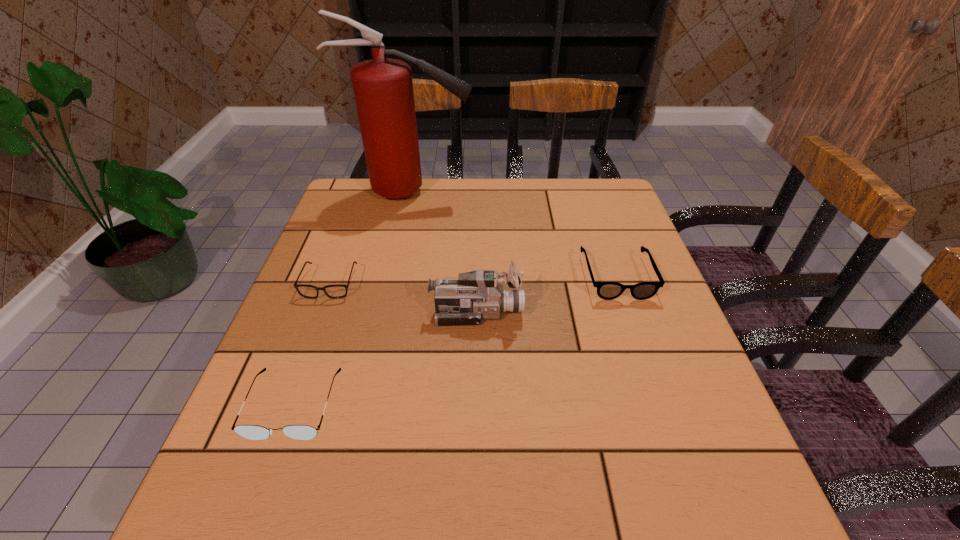
Locate an element on the screen. The height and width of the screenshot is (540, 960). vacant space located on the front-facing side of the shortest spectacles is located at coordinates (267, 451).

Image resolution: width=960 pixels, height=540 pixels. I want to click on object present at the far edge, so click(383, 88).

The width and height of the screenshot is (960, 540). Identify the location of fire extinguisher located in the left edge section of the desktop. (383, 88).

This screenshot has width=960, height=540. What are the coordinates of `object situated at the right edge` in the screenshot? It's located at (606, 290).

This screenshot has height=540, width=960. What are the coordinates of `object present at the far left corner` in the screenshot? It's located at (383, 88).

The image size is (960, 540). Find the location of `free spot at the far edge of the desktop`. free spot at the far edge of the desktop is located at coordinates (513, 185).

I want to click on vacant region at the near edge of the desktop, so click(x=442, y=506).

The height and width of the screenshot is (540, 960). I want to click on vacant space at the left edge of the desktop, so click(x=283, y=412).

At what (x,y) coordinates should I click in order to perform the action: click on free space at the right edge of the desktop. Please return your answer as a coordinate pair (x, y). Looking at the image, I should click on (709, 417).

Where is `free space at the far left corner of the desktop`? The image size is (960, 540). free space at the far left corner of the desktop is located at coordinates (368, 197).